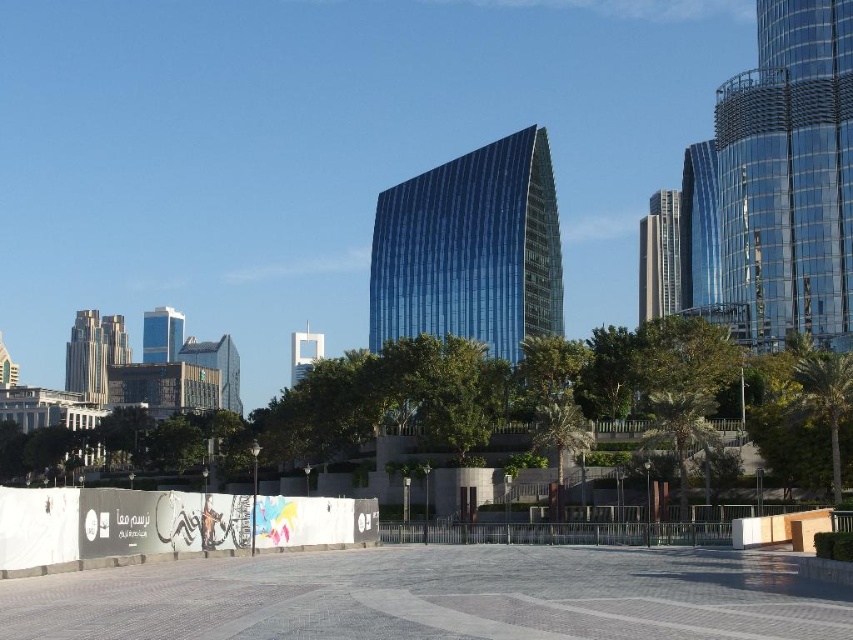
Question: Which point appears closest to the camera in this image?

Choices:
 (A) (113, 346)
 (B) (306, 321)

Answer: (B)

Question: Can you confirm if blue glass building at center is positioned to the left of transparent glass tower at center?

Choices:
 (A) yes
 (B) no

Answer: (B)

Question: Among these points, which one is nearest to the camera?

Choices:
 (A) (645, 216)
 (B) (105, 365)
 (C) (425, 284)
 (D) (850, 321)

Answer: (D)

Question: Which point appears farthest from the camera in this image?

Choices:
 (A) (233, 358)
 (B) (115, 326)
 (C) (698, 172)
 (D) (173, 337)

Answer: (B)

Question: Does blue glass building at center have a lesser width compared to transparent glass tower at center?

Choices:
 (A) yes
 (B) no

Answer: (B)

Question: Does metallic glass skyscraper at right appear under glassy metallic skyscraper at center?

Choices:
 (A) yes
 (B) no

Answer: (B)